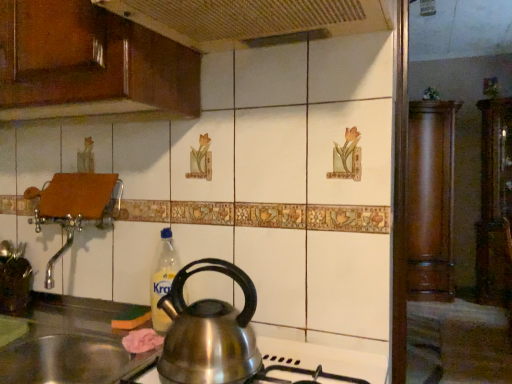
The width and height of the screenshot is (512, 384). What do you see at coordinates (253, 20) in the screenshot?
I see `wooden panel at upper left` at bounding box center [253, 20].

Based on the photo, what is the approximate height of glossy wood cabinetry at upper left, which is the first cabinetry from left to right?

The height of glossy wood cabinetry at upper left, which is the first cabinetry from left to right, is 43.65 centimeters.

The height and width of the screenshot is (384, 512). What do you see at coordinates (209, 332) in the screenshot? I see `shiny metallic kettle at center` at bounding box center [209, 332].

Identify the location of polished stainless steel kettle at lower center. The height and width of the screenshot is (384, 512). (324, 359).

Describe the element at coordinates (70, 345) in the screenshot. I see `stainless steel sink at lower left` at that location.

Identify the location of mahogany wood cabinet at right, which is the first cabinetry from back to front. The height and width of the screenshot is (384, 512). coord(431,199).

The width and height of the screenshot is (512, 384). What are the coordinates of `wooden panel at upper left` in the screenshot? It's located at (253, 20).

Which of these two, glossy wood cabinetry at upper left, placed as the third cabinetry when sorted from back to front, or stainless steel sink at lower left, stands shorter?

stainless steel sink at lower left.

Is stainless steel sink at lower left surrounded by glossy wood cabinetry at upper left, which is the first cabinetry from left to right?

No, stainless steel sink at lower left is located outside of glossy wood cabinetry at upper left, which is the first cabinetry from left to right.

Between glossy wood cabinetry at upper left, which is the first cabinetry from left to right, and stainless steel sink at lower left, which one is positioned in front?

stainless steel sink at lower left is closer to the camera.

Is glossy wood cabinetry at upper left, placed as the third cabinetry when sorted from back to front, oriented towards stainless steel sink at lower left?

No, glossy wood cabinetry at upper left, placed as the third cabinetry when sorted from back to front, is not turned towards stainless steel sink at lower left.

Identify the location of cabinetry that is the 2nd one above the stainless steel sink at lower left (from a real-world perspective). This screenshot has width=512, height=384. (495, 203).

Is wooden cabinet at right, positioned as the second cabinetry in back-to-front order, bigger than stainless steel sink at lower left?

Yes.

Is wooden cabinet at right, the first cabinetry positioned from the right, further to camera compared to stainless steel sink at lower left?

Yes, it is behind stainless steel sink at lower left.

From the image's perspective, which is below, wooden cabinet at right, the first cabinetry positioned from the right, or stainless steel sink at lower left?

stainless steel sink at lower left, from the image's perspective.

Considering the relative sizes of shiny metallic kettle at center and glossy wood cabinetry at upper left, which is the first cabinetry from left to right, in the image provided, is shiny metallic kettle at center thinner than glossy wood cabinetry at upper left, which is the first cabinetry from left to right,?

Yes, shiny metallic kettle at center is thinner than glossy wood cabinetry at upper left, which is the first cabinetry from left to right.

Does point (191, 310) appear closer or farther from the camera than point (32, 63)?

Point (191, 310) is positioned closer to the camera compared to point (32, 63).

Which object is further away from the camera taking this photo, shiny metallic kettle at center or glossy wood cabinetry at upper left, which is the 1th cabinetry in front-to-back order?

glossy wood cabinetry at upper left, which is the 1th cabinetry in front-to-back order, is further from the camera.

Is wooden cabinet at right, the 3th cabinetry positioned from the left, facing away from glossy wood cabinetry at upper left, which is the first cabinetry from left to right?

No, glossy wood cabinetry at upper left, which is the first cabinetry from left to right, is not at the back of wooden cabinet at right, the 3th cabinetry positioned from the left.

In the image, is wooden cabinet at right, positioned as the second cabinetry in back-to-front order, on the left side or the right side of glossy wood cabinetry at upper left, placed as the 3th cabinetry when sorted from right to left?

In the image, wooden cabinet at right, positioned as the second cabinetry in back-to-front order, appears on the right side of glossy wood cabinetry at upper left, placed as the 3th cabinetry when sorted from right to left.

Is point (508, 284) behind point (115, 29)?

That is True.

Would you say wooden cabinet at right, positioned as the second cabinetry in back-to-front order, is outside glossy wood cabinetry at upper left, placed as the third cabinetry when sorted from back to front?

That's correct, wooden cabinet at right, positioned as the second cabinetry in back-to-front order, is outside of glossy wood cabinetry at upper left, placed as the third cabinetry when sorted from back to front.

Is glossy wood cabinetry at upper left, which is the first cabinetry from left to right, to the right of wooden panel at upper left from the viewer's perspective?

No.

Is the position of glossy wood cabinetry at upper left, placed as the 3th cabinetry when sorted from right to left, more distant than that of wooden panel at upper left?

Yes, glossy wood cabinetry at upper left, placed as the 3th cabinetry when sorted from right to left, is further from the camera.

Looking at this image, from a real-world perspective, relative to wooden panel at upper left, is glossy wood cabinetry at upper left, placed as the third cabinetry when sorted from back to front, vertically above or below?

glossy wood cabinetry at upper left, placed as the third cabinetry when sorted from back to front, is situated lower than wooden panel at upper left in the real world.

Is glossy wood cabinetry at upper left, placed as the 3th cabinetry when sorted from right to left, facing towards wooden panel at upper left?

No, glossy wood cabinetry at upper left, placed as the 3th cabinetry when sorted from right to left, is not facing towards wooden panel at upper left.

From a real-world perspective, which is physically above, matte brown pot at left or shiny metallic kettle at center?

shiny metallic kettle at center is physically above.

Between point (15, 314) and point (211, 373), which one is positioned in front?

The point (211, 373) is closer to the camera.

Is matte brown pot at left positioned beyond the bounds of shiny metallic kettle at center?

Yes.

Which of these two, matte brown pot at left or shiny metallic kettle at center, is thinner?

Thinner between the two is matte brown pot at left.

Does stainless steel sink at lower left have a lesser height compared to matte brown pot at left?

Incorrect, the height of stainless steel sink at lower left does not fall short of that of matte brown pot at left.

Does stainless steel sink at lower left have a smaller size compared to matte brown pot at left?

No, stainless steel sink at lower left is not smaller than matte brown pot at left.

From the image's perspective, is stainless steel sink at lower left under matte brown pot at left?

Correct, stainless steel sink at lower left appears lower than matte brown pot at left in the image.

What are the coordinates of `sink below the glossy wood cabinetry at upper left, placed as the 3th cabinetry when sorted from right to left (from a real-world perspective)` in the screenshot? It's located at (70, 345).

Identify the location of the 2nd cabinetry above the stainless steel sink at lower left (from the image's perspective). (495, 203).

Looking at this image, looking at the image, which one is located further to matte brown pot at left, polished stainless steel kettle at lower center or mahogany wood cabinet at right, the 3th cabinetry positioned from the front?

mahogany wood cabinet at right, the 3th cabinetry positioned from the front, is further to matte brown pot at left.

Considering their positions, is matte brown pot at left positioned further to glossy wood cabinetry at upper left, placed as the third cabinetry when sorted from back to front, than stainless steel sink at lower left?

Based on the image, matte brown pot at left appears to be further to glossy wood cabinetry at upper left, placed as the third cabinetry when sorted from back to front.

Considering their positions, is wooden cabinet at right, the 3th cabinetry positioned from the left, positioned closer to mahogany wood cabinet at right, the second cabinetry in the right-to-left sequence, than stainless steel sink at lower left?

The object closer to mahogany wood cabinet at right, the second cabinetry in the right-to-left sequence, is wooden cabinet at right, the 3th cabinetry positioned from the left.

Based on their spatial positions, is glossy wood cabinetry at upper left, which is the 1th cabinetry in front-to-back order, or wooden cabinet at right, the 3th cabinetry positioned from the left, further from mahogany wood cabinet at right, which is the first cabinetry from back to front?

glossy wood cabinetry at upper left, which is the 1th cabinetry in front-to-back order, lies further to mahogany wood cabinet at right, which is the first cabinetry from back to front, than the other object.

Based on their spatial positions, is shiny metallic kettle at center or stainless steel sink at lower left closer to wooden cabinet at right, positioned as the second cabinetry in back-to-front order?

shiny metallic kettle at center is positioned closer to the anchor wooden cabinet at right, positioned as the second cabinetry in back-to-front order.

Which object lies further to the anchor point wooden cabinet at right, positioned as the second cabinetry in back-to-front order, wooden panel at upper left or mahogany wood cabinet at right, the 3th cabinetry positioned from the front?

wooden panel at upper left is positioned further to the anchor wooden cabinet at right, positioned as the second cabinetry in back-to-front order.

From the image, which object appears to be nearer to matte brown pot at left, wooden panel at upper left or glossy wood cabinetry at upper left, which is the 1th cabinetry in front-to-back order?

glossy wood cabinetry at upper left, which is the 1th cabinetry in front-to-back order, is positioned closer to the anchor matte brown pot at left.

Considering their positions, is wooden panel at upper left positioned closer to shiny metallic kettle at center than mahogany wood cabinet at right, the 3th cabinetry positioned from the front?

wooden panel at upper left lies closer to shiny metallic kettle at center than the other object.

Where is `kettle that lies between glossy wood cabinetry at upper left, placed as the 3th cabinetry when sorted from right to left, and stainless steel sink at lower left from top to bottom`? kettle that lies between glossy wood cabinetry at upper left, placed as the 3th cabinetry when sorted from right to left, and stainless steel sink at lower left from top to bottom is located at coordinates (209, 332).

What are the coordinates of `appliance positioned between shiny metallic kettle at center and mahogany wood cabinet at right, the 3th cabinetry positioned from the front, from near to far` in the screenshot? It's located at (15, 285).

The image size is (512, 384). What are the coordinates of `sink between polished stainless steel kettle at lower center and wooden cabinet at right, the 2th cabinetry in the front-to-back sequence, from front to back` in the screenshot? It's located at (70, 345).

The width and height of the screenshot is (512, 384). Identify the location of kettle positioned between polished stainless steel kettle at lower center and wooden cabinet at right, the 3th cabinetry positioned from the left, from near to far. (209, 332).